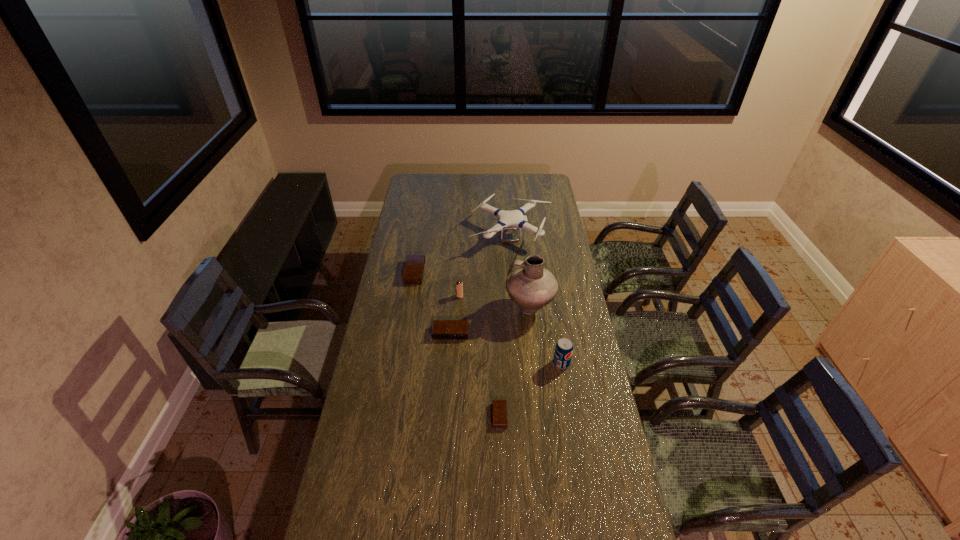
This screenshot has height=540, width=960. In order to click on vacant space located on the front face of the leftmost alarm clock in this screenshot , I will do `click(391, 272)`.

Where is `vacant region located 0.080m on the front face of the second shortest object`? The height and width of the screenshot is (540, 960). vacant region located 0.080m on the front face of the second shortest object is located at coordinates (449, 355).

This screenshot has height=540, width=960. I want to click on vacant region located 0.330m on the front face of the nearest object, so click(399, 415).

You are a GUI agent. You are given a task and a screenshot of the screen. Output one action in this format:
    pyautogui.click(x=<x>, y=<y>)
    Task: Click on the vacant space located 0.260m on the front face of the nearest object
    
    Given the screenshot: What is the action you would take?
    pyautogui.click(x=420, y=415)

Locate an element on the screen. vacant space located on the front face of the nearest object is located at coordinates (469, 415).

You are a GUI agent. You are given a task and a screenshot of the screen. Output one action in this format:
    pyautogui.click(x=<x>, y=<y>)
    Task: Click on the free space located 0.140m on the left of the drone
    This screenshot has width=960, height=540.
    Given the screenshot: What is the action you would take?
    pyautogui.click(x=443, y=236)

Where is `free space located on the back of the pop`? free space located on the back of the pop is located at coordinates pyautogui.click(x=557, y=337).

The image size is (960, 540). I want to click on free space located on the handle side of the tallest object, so click(460, 308).

Locate an element on the screen. This screenshot has width=960, height=540. free space located 0.230m on the handle side of the tallest object is located at coordinates (452, 308).

Identify the location of vacant space located on the handle side of the tallest object. Image resolution: width=960 pixels, height=540 pixels. (419, 308).